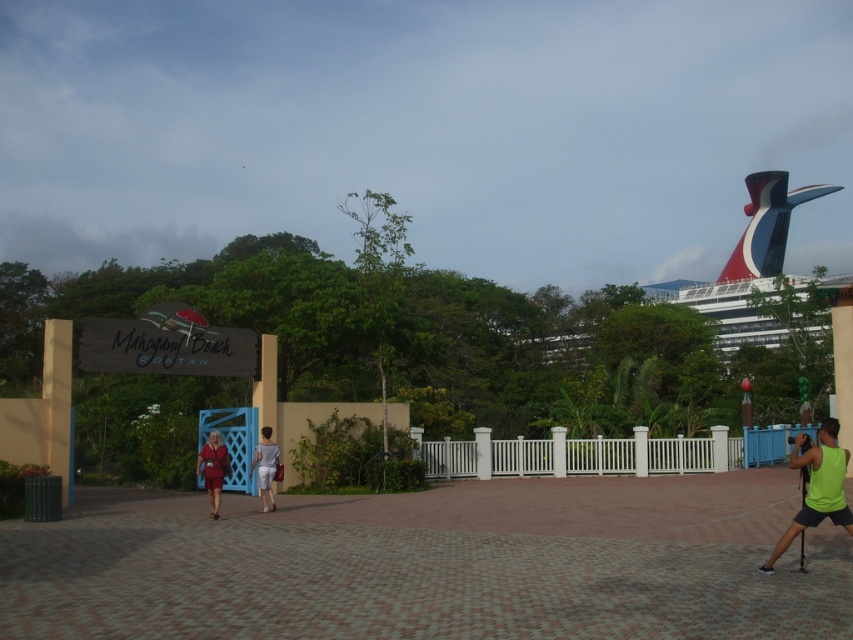
Question: Observing the image, what is the correct spatial positioning of polished steel cruise ship at upper right in reference to matte red dress at center?

Choices:
 (A) right
 (B) left

Answer: (A)

Question: Estimate the real-world distances between objects in this image. Which object is closer to the light gray fabric dress at center?

Choices:
 (A) polished steel cruise ship at upper right
 (B) matte red dress at center

Answer: (B)

Question: Considering the real-world distances, which object is farthest from the matte red dress at center?

Choices:
 (A) light gray fabric dress at center
 (B) polished steel cruise ship at upper right

Answer: (B)

Question: Which point is farther to the camera?

Choices:
 (A) (267, 467)
 (B) (196, 458)
 (C) (819, 461)

Answer: (B)

Question: Is neon green tank top at lower right closer to the viewer compared to light gray fabric dress at center?

Choices:
 (A) no
 (B) yes

Answer: (B)

Question: Is polished steel cruise ship at upper right closer to the viewer compared to matte red dress at center?

Choices:
 (A) no
 (B) yes

Answer: (A)